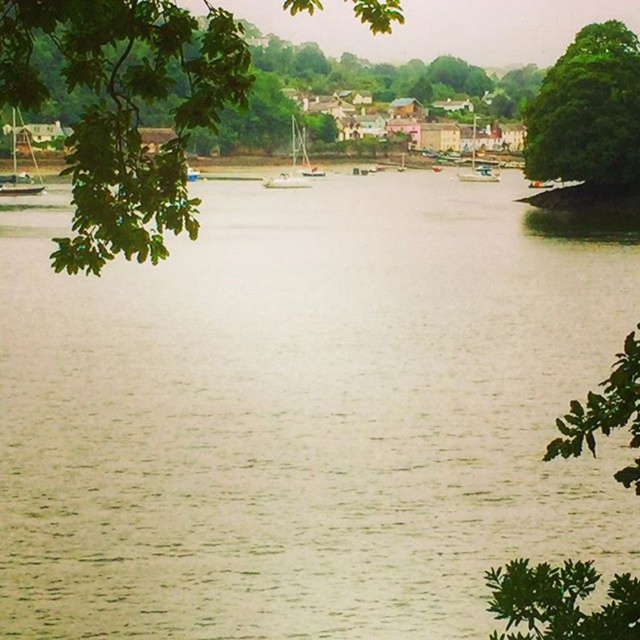
Question: Is brown water at center to the left of white glossy sailboat at center from the viewer's perspective?

Choices:
 (A) yes
 (B) no

Answer: (B)

Question: Among these points, which one is farthest from the camera?

Choices:
 (A) (604, 120)
 (B) (275, 182)

Answer: (B)

Question: Does green leafy tree at upper left have a lesser width compared to green leafy tree at upper right?

Choices:
 (A) no
 (B) yes

Answer: (A)

Question: Among these points, which one is farthest from the camera?

Choices:
 (A) (28, 106)
 (B) (19, 173)

Answer: (B)

Question: From the image, what is the correct spatial relationship of brown water at center in relation to green leafy tree at upper right?

Choices:
 (A) above
 (B) below

Answer: (B)

Question: Which of the following is the closest to the observer?

Choices:
 (A) (493, 168)
 (B) (612, 52)

Answer: (B)